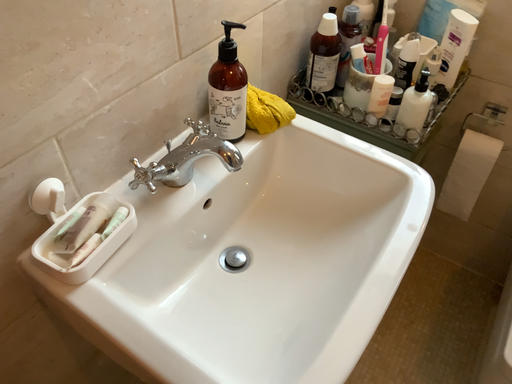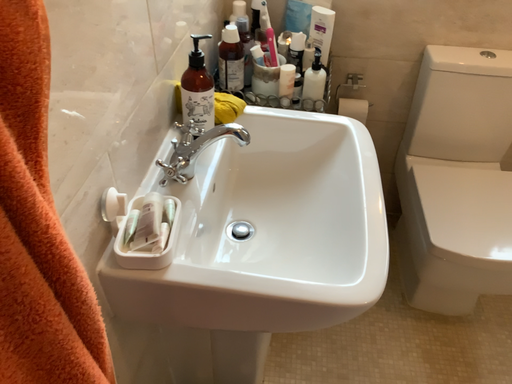
Question: How did the camera likely rotate when shooting the video?

Choices:
 (A) rotated right
 (B) rotated left

Answer: (A)